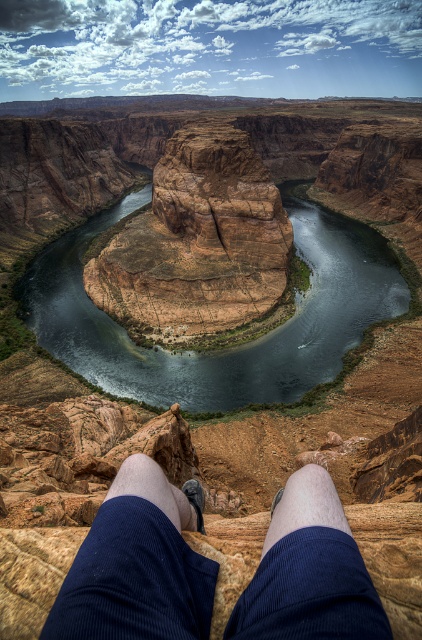
Question: Does brown rock river at center have a greater width compared to blue corduroy pants at lower center?

Choices:
 (A) yes
 (B) no

Answer: (A)

Question: Which of the following is the farthest from the observer?

Choices:
 (A) blue corduroy shorts at lower center
 (B) blue corduroy pants at lower center

Answer: (B)

Question: Which object appears farthest from the camera in this image?

Choices:
 (A) blue corduroy pants at lower center
 (B) blue corduroy shorts at lower center
 (C) brown rock river at center
 (D) pale skin at lower center

Answer: (C)

Question: Which point is closer to the camera taking this photo?

Choices:
 (A) (83, 344)
 (B) (332, 522)
 (C) (333, 611)
 (D) (126, 464)

Answer: (C)

Question: Can you confirm if brown rock river at center is bigger than pale skin at lower center?

Choices:
 (A) yes
 (B) no

Answer: (A)

Question: Can you confirm if pale skin at lower center is positioned to the right of blue corduroy pants at lower center?

Choices:
 (A) no
 (B) yes

Answer: (B)